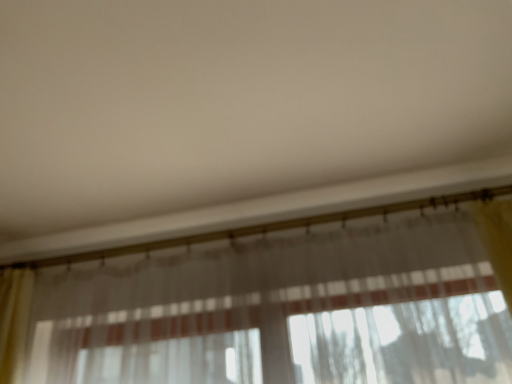
This screenshot has width=512, height=384. Describe the element at coordinates (279, 305) in the screenshot. I see `translucent fabric curtain at center` at that location.

This screenshot has width=512, height=384. What are the coordinates of `translucent fabric curtain at center` in the screenshot? It's located at (279, 305).

Locate an element on the screen. translucent fabric curtain at center is located at coordinates (279, 305).